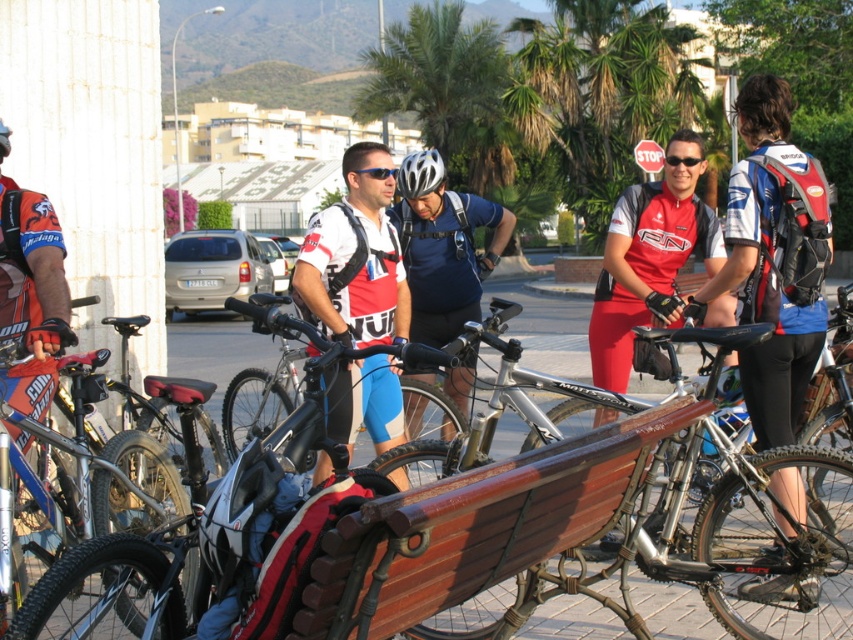
Question: Which of the following is the farthest from the observer?

Choices:
 (A) shiny blue helmet at center
 (B) silver metallic bicycle at center

Answer: (A)

Question: Which object is the closest to the shiny blue helmet at center?

Choices:
 (A) silver metallic bicycle at center
 (B) white matte jersey at center
 (C) black plastic goggles at center

Answer: (B)

Question: Estimate the real-world distances between objects in this image. Which object is closer to the blue fabric jersey at center?

Choices:
 (A) black plastic goggles at center
 (B) shiny blue helmet at center
 (C) silver metallic bicycle at center
 (D) silver metallic helmet at center

Answer: (C)

Question: Is silver metallic bicycle at center in front of black matte bicycle helmet at left?

Choices:
 (A) yes
 (B) no

Answer: (A)

Question: Can you confirm if silver metallic bicycle at center is positioned above silver metallic helmet at center?

Choices:
 (A) yes
 (B) no

Answer: (B)

Question: Does white matte jersey at center appear under black matte bicycle helmet at left?

Choices:
 (A) no
 (B) yes

Answer: (B)